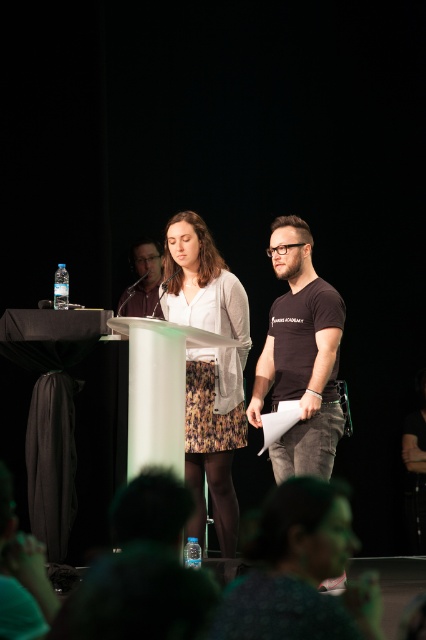
You are standing at the camera position and want to walk to point (x=328, y=452). Is the distance less than 4 meters?

The distance between point (x=328, y=452) and the camera is 3.65 meters, which is less than 4 meters.

You are an attendee at the event and want to locate the person wearing the green textured shirt at lower center. Based on the coordinates provided in the scene description, where should you look relative to the woman at the podium?

The green textured shirt at lower center is located at point 0.894 on the x axis and 0.702 on the y axis relative to the woman at the podium.

You are sitting in the audience and want to look at both points mentioned in the image. Which point, point [267,378] or point [141,275], will appear larger to you?

Point [267,378] is closer to the camera than point [141,275], so it will appear larger.